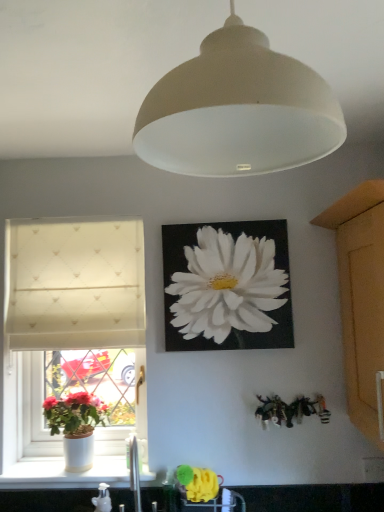
Measure the distance between white textured curtain at left and camera.

white textured curtain at left is 5.50 feet away from camera.

The image size is (384, 512). What are the coordinates of `white fabric window at left` in the screenshot? It's located at (72, 324).

At what (x,y) coordinates should I click in order to perform the action: click on white glossy sink at lower center. Please return your answer as a coordinate pair (x, y). The width and height of the screenshot is (384, 512). Looking at the image, I should click on (134, 472).

Find the location of a particular element. This screenshot has height=512, width=384. wooden cabinet at right is located at coordinates (363, 318).

In order to click on white matte lampshade at center in this screenshot , I will do `click(238, 110)`.

Locate an element on the screen. The width and height of the screenshot is (384, 512). window sill below the wooden cabinet at right (from a real-world perspective) is located at coordinates (64, 474).

Is white ceramic vase at lower left thinner than wooden cabinet at right?

Correct, the width of white ceramic vase at lower left is less than that of wooden cabinet at right.

From a real-world perspective, is white ceramic vase at lower left located higher than wooden cabinet at right?

No.

Is white ceramic vase at lower left completely or partially outside of wooden cabinet at right?

Yes, white ceramic vase at lower left is outside of wooden cabinet at right.

Is there a large distance between white fabric window at left and white glossy sink at lower center?

No, there isn't a large distance between white fabric window at left and white glossy sink at lower center.

Choose the correct answer: Is white fabric window at left inside white glossy sink at lower center or outside it?

The correct answer is: outside.

Is point (47, 435) more distant than point (134, 468)?

Yes, it is.

Locate an element on the screen. houseplant positioned vertically above the white ceramic vase at lower left (from a real-world perspective) is located at coordinates (76, 426).

Could you tell me if white ceramic vase at lower left is turned towards matte white pot at window?

No, white ceramic vase at lower left is not turned towards matte white pot at window.

Is white ceramic vase at lower left to the left or to the right of matte white pot at window in the image?

Based on their positions, white ceramic vase at lower left is located to the right of matte white pot at window.

Which point is more forward, (18, 475) or (59, 422)?

The point (18, 475) is closer to the camera.

Does white fabric window at left have a larger size compared to white textured curtain at left?

Yes.

Which object is more forward, white fabric window at left or white textured curtain at left?

white fabric window at left.

From a real-world perspective, does white fabric window at left sit lower than white textured curtain at left?

Indeed, from a real-world perspective, white fabric window at left is positioned beneath white textured curtain at left.

From the image's perspective, which object appears higher, white fabric window at left or white textured curtain at left?

white textured curtain at left appears higher in the image.

Is matte white pot at window positioned in front of white ceramic vase at lower left?

Yes, it is.

How many degrees apart are the facing directions of matte white pot at window and white ceramic vase at lower left?

There is a 0.55-degree angle between the facing directions of matte white pot at window and white ceramic vase at lower left.

Considering the sizes of objects matte white pot at window and white ceramic vase at lower left in the image provided, who is shorter, matte white pot at window or white ceramic vase at lower left?

Standing shorter between the two is white ceramic vase at lower left.

Are matte white pot at window and white ceramic vase at lower left far apart?

No.

In the scene shown: Is wooden cabinet at right taller than white ceramic vase at lower left?

Correct, wooden cabinet at right is much taller as white ceramic vase at lower left.

Is wooden cabinet at right spatially inside white ceramic vase at lower left, or outside of it?

wooden cabinet at right is spatially situated outside white ceramic vase at lower left.

Does wooden cabinet at right lie behind white ceramic vase at lower left?

No, the depth of wooden cabinet at right is less than that of white ceramic vase at lower left.

In the scene shown: Is white glossy sink at lower center located outside white ceramic vase at lower left?

Absolutely, white glossy sink at lower center is external to white ceramic vase at lower left.

From the picture: Is white glossy sink at lower center far away from white ceramic vase at lower left?

Actually, white glossy sink at lower center and white ceramic vase at lower left are a little close together.

From the image's perspective, between white glossy sink at lower center and white ceramic vase at lower left, which one is located above?

white glossy sink at lower center is shown above in the image.

The image size is (384, 512). I want to click on window sill below the wooden cabinet at right (from the image's perspective), so click(x=64, y=474).

The width and height of the screenshot is (384, 512). I want to click on window above the white glossy sink at lower center (from the image's perspective), so click(x=72, y=324).

Which object lies nearer to the anchor point white ceramic vase at lower left, white matte lampshade at center or white matte canvas at upper center?

white matte canvas at upper center is positioned closer to the anchor white ceramic vase at lower left.

Looking at the image, which one is located further to white fabric window at left, matte white pot at window or white textured curtain at left?

matte white pot at window is positioned further to the anchor white fabric window at left.

Consider the image. From the image, which object appears to be nearer to white fabric window at left, white glossy sink at lower center or matte white pot at window?

matte white pot at window is positioned closer to the anchor white fabric window at left.

Considering their positions, is white matte canvas at upper center positioned further to wooden cabinet at right than white ceramic vase at lower left?

white ceramic vase at lower left lies further to wooden cabinet at right than the other object.

Based on their spatial positions, is white ceramic vase at lower left or white textured curtain at left further from white matte canvas at upper center?

Based on the image, white ceramic vase at lower left appears to be further to white matte canvas at upper center.

When comparing their distances from white matte lampshade at center, does matte white pot at window or white ceramic vase at lower left seem further?

white ceramic vase at lower left is further to white matte lampshade at center.

Estimate the real-world distances between objects in this image. Which object is further from white fabric window at left, matte white pot at window or wooden cabinet at right?

wooden cabinet at right lies further to white fabric window at left than the other object.

Looking at the image, which one is located further to matte white pot at window, white ceramic vase at lower left or white matte canvas at upper center?

The object further to matte white pot at window is white matte canvas at upper center.

What are the coordinates of `window that lies between white textured curtain at left and white glossy sink at lower center from top to bottom` in the screenshot? It's located at (72, 324).

At what (x,y) coordinates should I click in order to perform the action: click on sink between white textured curtain at left and wooden cabinet at right in the horizontal direction. Please return your answer as a coordinate pair (x, y). The width and height of the screenshot is (384, 512). Looking at the image, I should click on (134, 472).

You are a GUI agent. You are given a task and a screenshot of the screen. Output one action in this format:
    pyautogui.click(x=<x>, y=<y>)
    Task: Click on the window that lies between white matte canvas at upper center and white ceramic vase at lower left from top to bottom
    
    Given the screenshot: What is the action you would take?
    pyautogui.click(x=72, y=324)

Image resolution: width=384 pixels, height=512 pixels. Identify the location of flower situated between white fabric window at left and wooden cabinet at right from left to right. (227, 286).